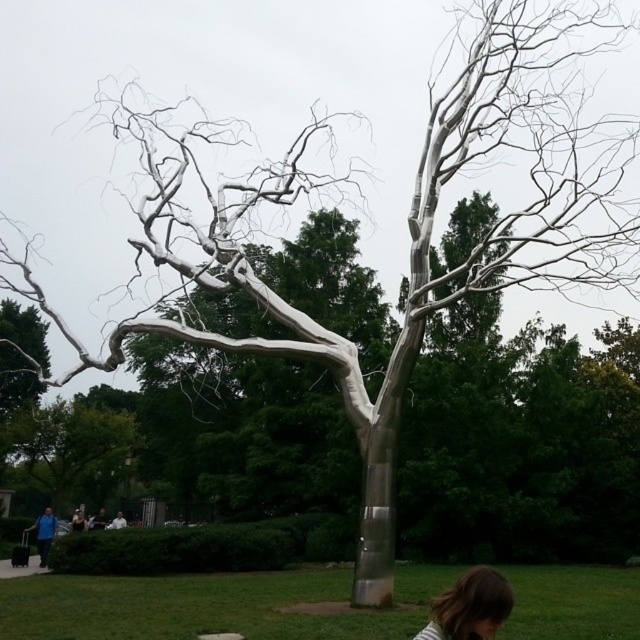
Question: Does silver metallic tree at center have a smaller size compared to dark brown hair at lower right?

Choices:
 (A) no
 (B) yes

Answer: (A)

Question: Estimate the real-world distances between objects in this image. Which object is closer to the white matte shirt at lower center?

Choices:
 (A) silver metallic tree at center
 (B) dark brown hair at lower right
 (C) blue fabric person at lower left

Answer: (C)

Question: Can you confirm if silver metallic tree at center is smaller than blue fabric person at lower left?

Choices:
 (A) no
 (B) yes

Answer: (A)

Question: Which point is farther from the camera taking this photo?

Choices:
 (A) (42, 528)
 (B) (120, 516)

Answer: (B)

Question: Can you confirm if dark brown hair at lower right is positioned to the right of blue fabric person at lower left?

Choices:
 (A) yes
 (B) no

Answer: (A)

Question: Which point appears closest to the camera in this image?

Choices:
 (A) (116, 524)
 (B) (563, 586)

Answer: (B)